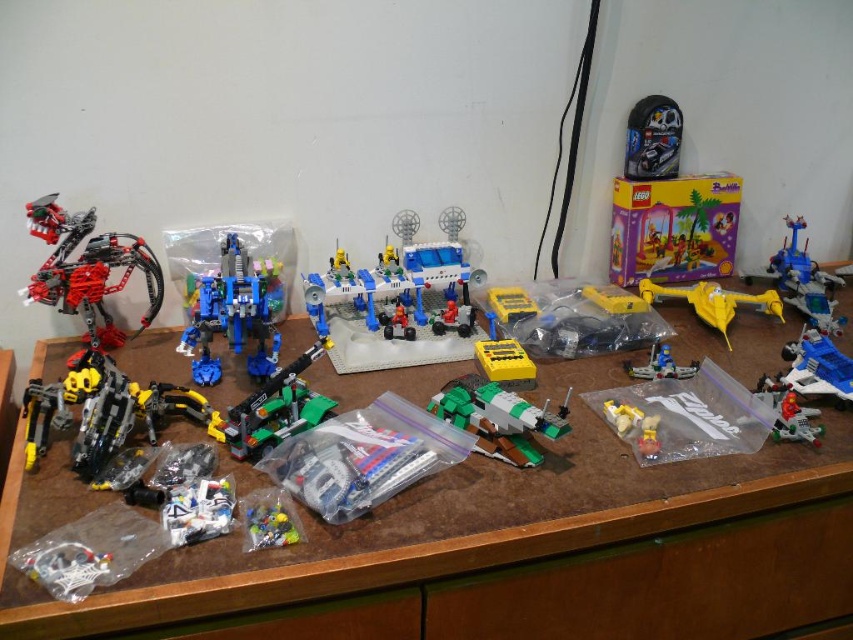
You are a LEGO enthusiast examining the table. You need to place a new LEGO set exactly at the center of the table. The green matte spaceship at center is currently occupying a specific location. Where should you place the new set to ensure it is centered?

The green matte spaceship at center is located at point (498, 419), so to place the new set at the true center of the table, you should position it at coordinates (426, 320) instead of where the spaceship is currently placed.

Looking at this image, you are organizing a LEGO display and need to place the white plastic toy at lower left and the translucent blue plastic spaceship at center on a shelf. The shelf has a width limit of 20 cm. If the spaceship takes up 15 cm of space, will both items fit on the shelf together?

The white plastic toy at lower left has a lesser width compared to the translucent blue plastic spaceship at center. Since the spaceship takes up 15 cm and the shelf has a 20 cm limit, there is 5 cm remaining. However, the width of the white plastic toy at lower left is less than 15 cm, so it might fit depending on its exact size. But without knowing the exact width of the toy, we cannot confirm for sure.

You are standing 1 meter away from the wooden table where the LEGO models are displayed. If you want to reach the point at coordinates (782, 428) on the table, will you be able to touch it without moving closer?

The distance of point (782, 428) from the viewer is 1.01 meters, so you are currently 1 meter away and would need to move 0.01 meters closer to reach it. Therefore, you cannot touch it without moving closer.